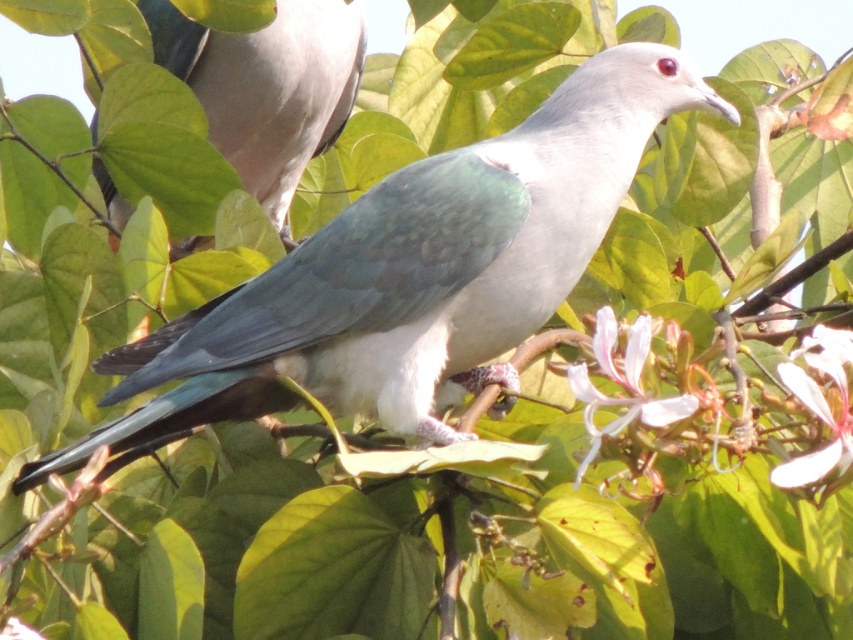
You are a photographer trying to capture the bird in the center of the image. The camera you are using has a focus point at coordinate point (410, 275). Will this focus point be effective for capturing the matte green bird at center?

The matte green bird at center is represented by point (410, 275), so the focus point at coordinate point (410, 275) will be effective for capturing the matte green bird at center.

You are an ornithologist observing two birds in a forest. You notice a matte green bird at center and a matte gray dove at upper left. Which bird would cast a longer shadow if the sun is directly overhead?

The matte green bird at center is much taller than the matte gray dove at upper left, so it would cast a longer shadow.